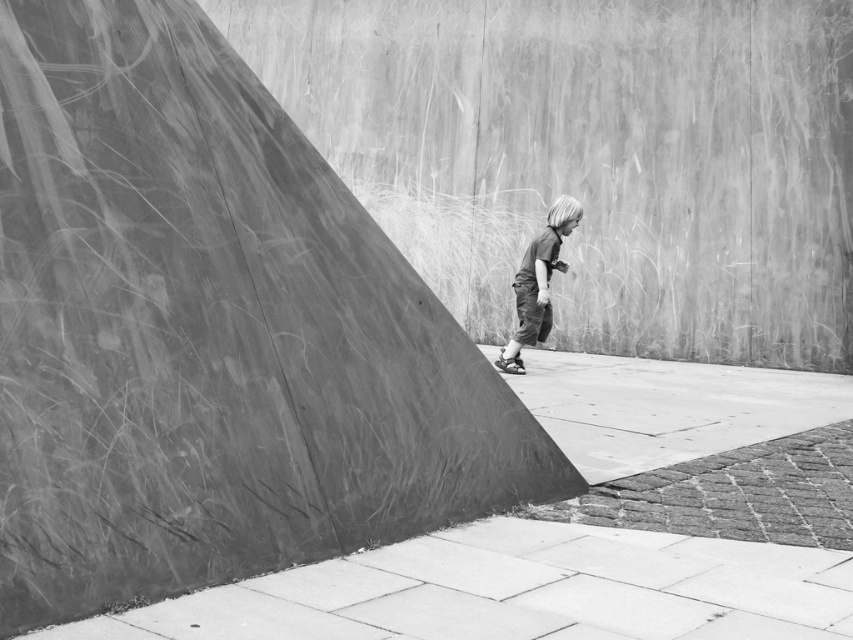
Who is positioned more to the left, smooth concrete ramp at center or smooth concrete pavement at lower center?

smooth concrete ramp at center is more to the left.

The height and width of the screenshot is (640, 853). Describe the element at coordinates (209, 332) in the screenshot. I see `smooth concrete ramp at center` at that location.

Identify the location of smooth concrete ramp at center. (209, 332).

Does point (750, 560) lie in front of point (560, 243)?

Yes, point (750, 560) is in front of point (560, 243).

Does point (321, 627) come behind point (512, 353)?

That is False.

Where is `smooth concrete pavement at lower center`? smooth concrete pavement at lower center is located at coordinates (517, 592).

I want to click on smooth concrete pavement at lower center, so click(x=517, y=592).

Is smooth concrete ramp at center wider than dark gray fabric pants at center?

Yes, smooth concrete ramp at center is wider than dark gray fabric pants at center.

Can you confirm if smooth concrete ramp at center is thinner than dark gray fabric pants at center?

No.

Does point (155, 218) come behind point (560, 212)?

No, (155, 218) is in front of (560, 212).

Where is `smooth concrete ramp at center`? The height and width of the screenshot is (640, 853). smooth concrete ramp at center is located at coordinates (209, 332).